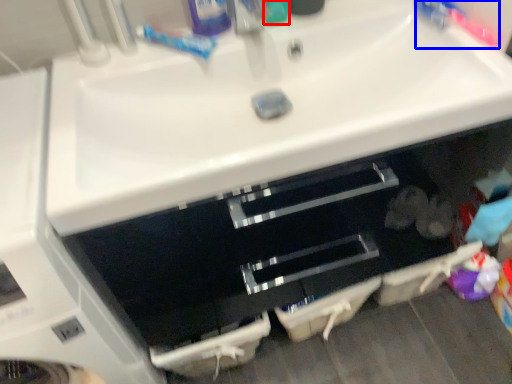
Question: Which object is further to the camera taking this photo, toiletry (highlighted by a red box) or toothbrush (highlighted by a blue box)?

Choices:
 (A) toiletry
 (B) toothbrush

Answer: (A)